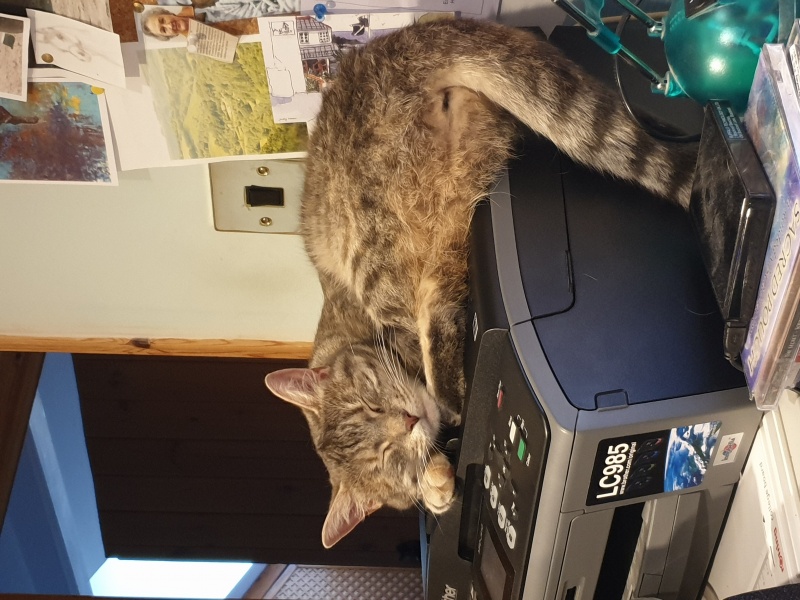
Where is `black switch`? The height and width of the screenshot is (600, 800). black switch is located at coordinates (266, 193).